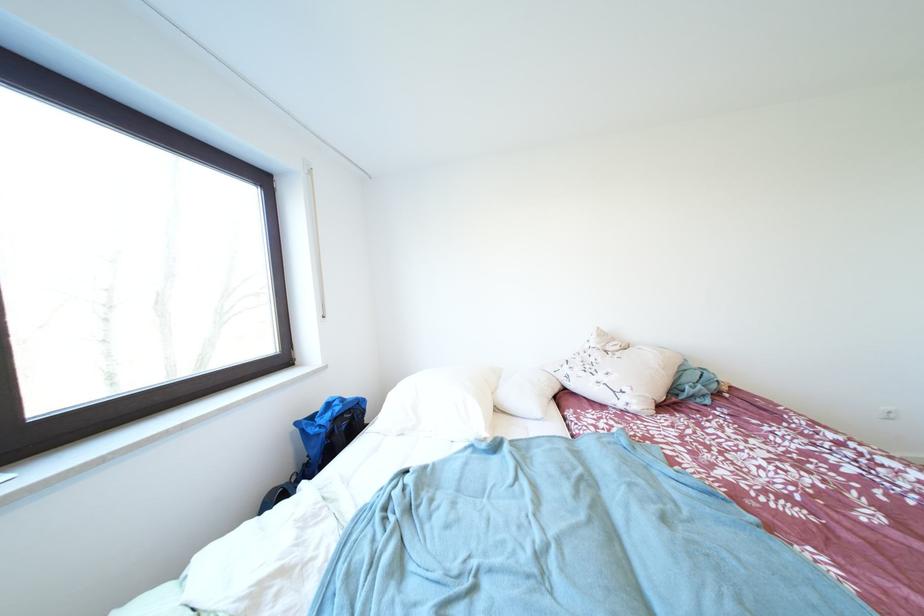
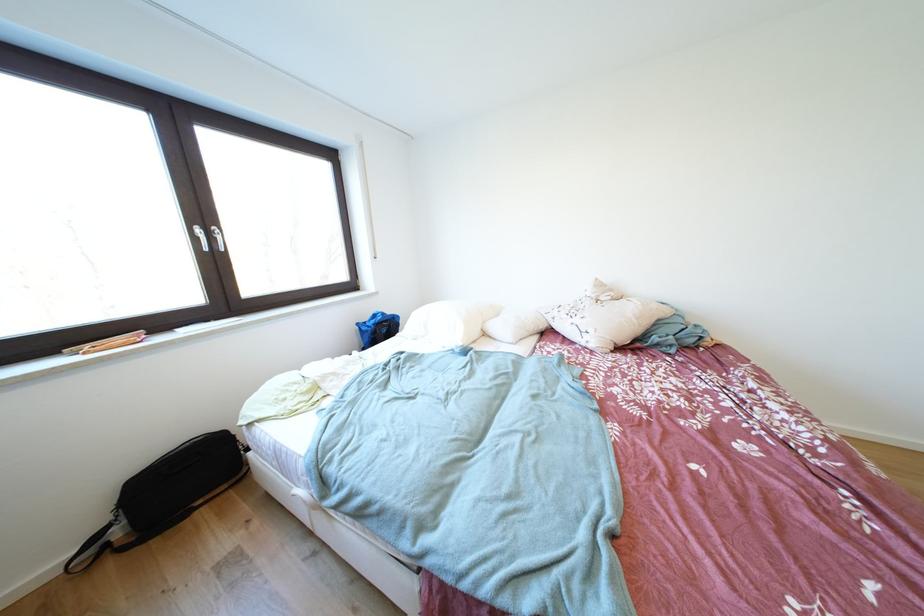
The point at (606, 333) is marked in the first image. Where is the corresponding point in the second image?

(604, 284)